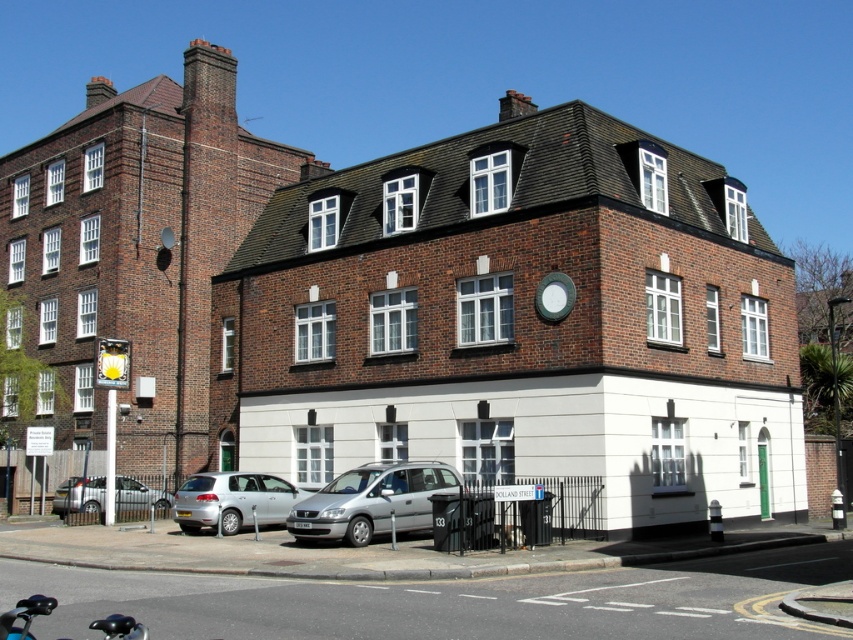
Which is more to the left, silver metallic van at center or blue matte motorcycle at lower left?

blue matte motorcycle at lower left

Between silver metallic van at center and blue matte motorcycle at lower left, which one is positioned lower?

Positioned lower is silver metallic van at center.

Find the location of a particular element. This screenshot has height=640, width=853. silver metallic van at center is located at coordinates (372, 500).

Which is more to the right, silver metallic hatchback at lower left or silver metallic van at lower left?

silver metallic hatchback at lower left is more to the right.

Can you confirm if silver metallic hatchback at lower left is bigger than silver metallic van at lower left?

Correct, silver metallic hatchback at lower left is larger in size than silver metallic van at lower left.

Measure the distance between silver metallic hatchback at lower left and camera.

28.73 meters

This screenshot has height=640, width=853. I want to click on silver metallic hatchback at lower left, so (231, 500).

Does silver metallic van at lower left have a larger size compared to blue matte motorcycle at lower left?

Incorrect, silver metallic van at lower left is not larger than blue matte motorcycle at lower left.

Who is lower down, silver metallic van at lower left or blue matte motorcycle at lower left?

silver metallic van at lower left is lower down.

Looking at this image, who is more forward, (170, 500) or (117, 630)?

Point (117, 630) is more forward.

Find the location of `silver metallic van at lower left`. silver metallic van at lower left is located at coordinates pyautogui.click(x=79, y=496).